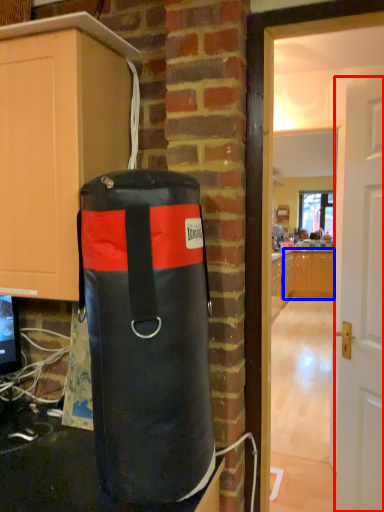
Question: Among these objects, which one is farthest to the camera, door (highlighted by a red box) or cabinetry (highlighted by a blue box)?

Choices:
 (A) door
 (B) cabinetry

Answer: (B)